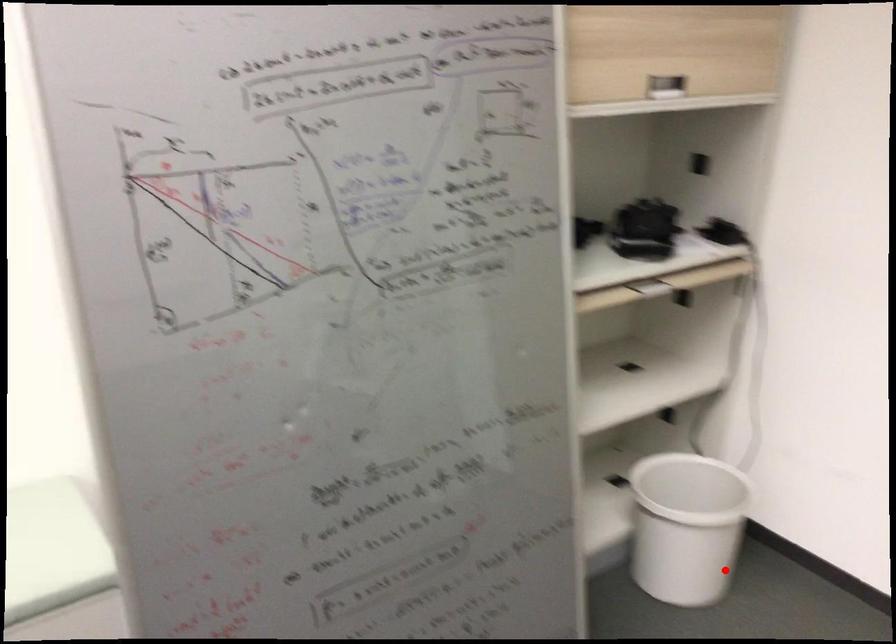
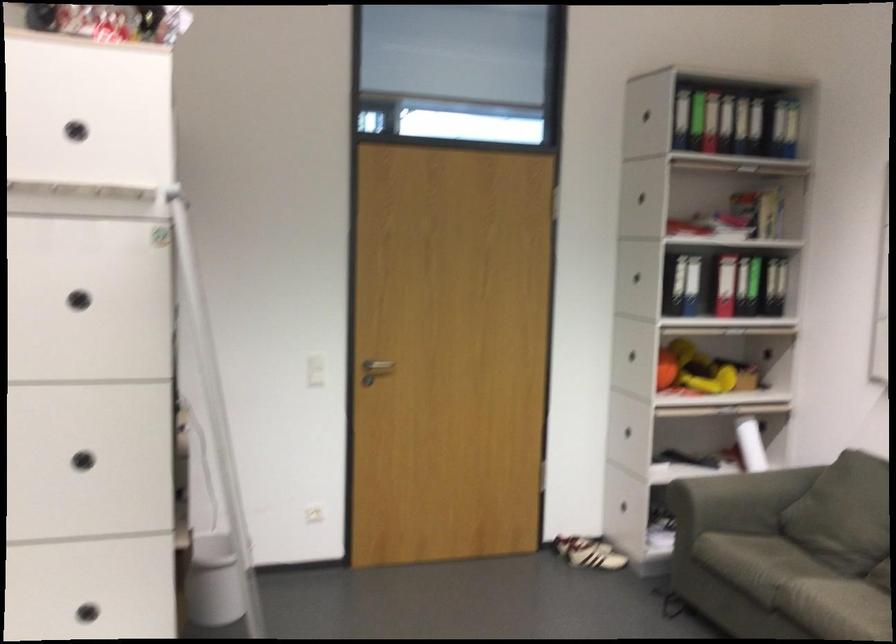
The point at the highlighted location is marked in the first image. Where is the corresponding point in the second image?

(213, 581)